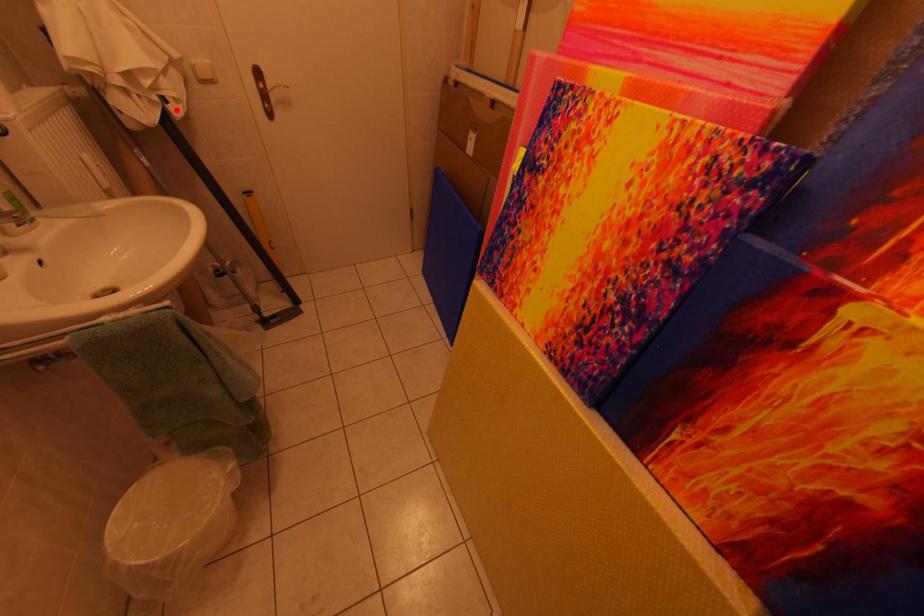
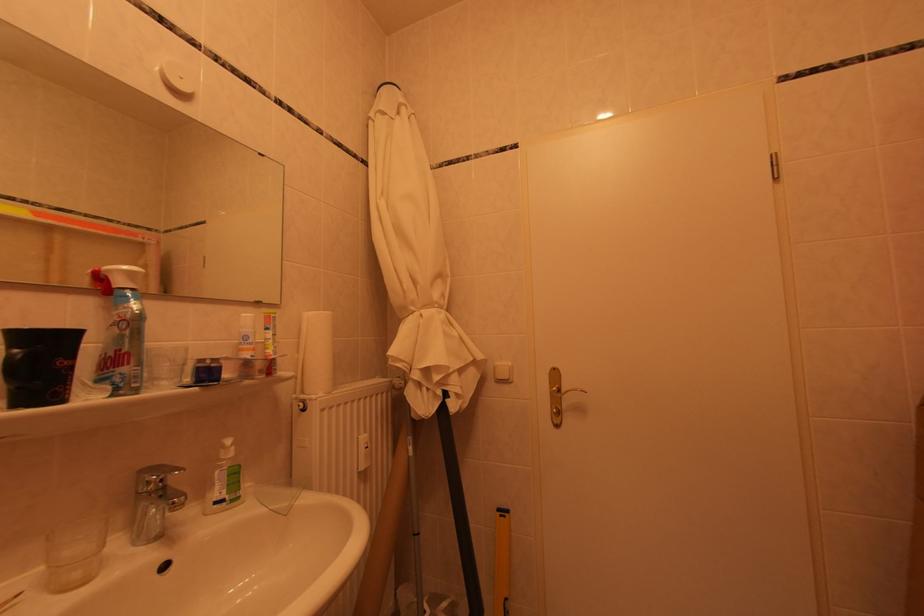
Where in the second image is the point corresponding to the highlighted location from the first image?

(456, 405)